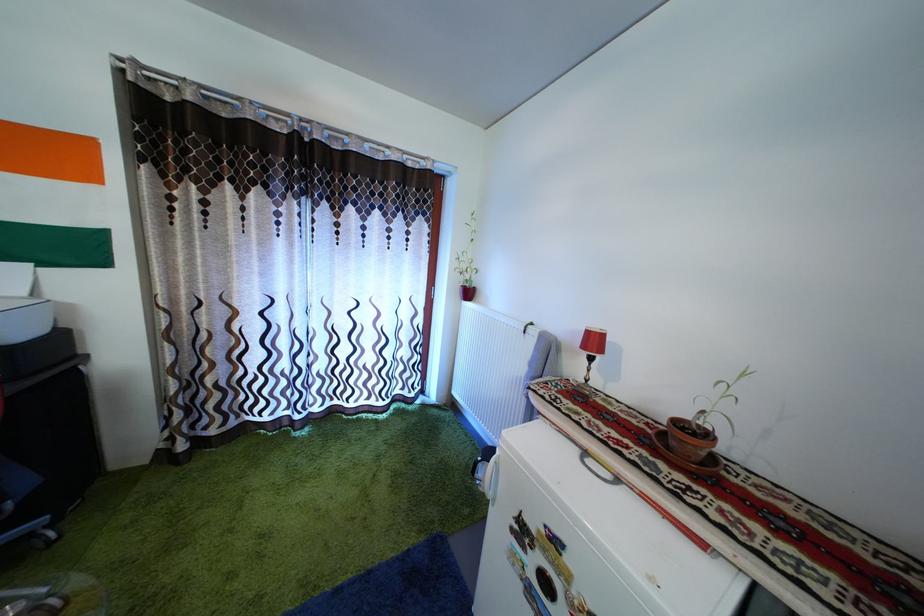
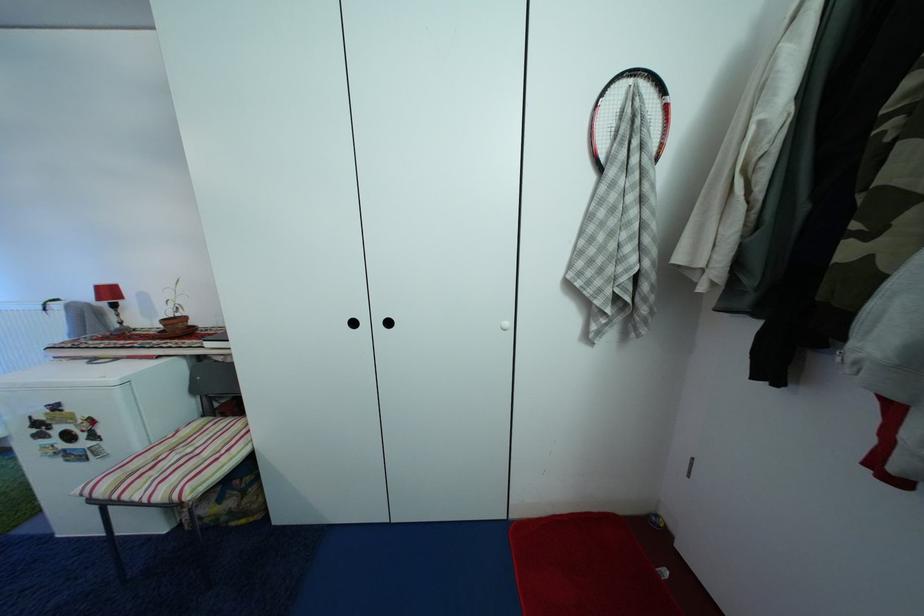
The point at [598,339] is marked in the first image. Where is the corresponding point in the second image?

(106, 294)